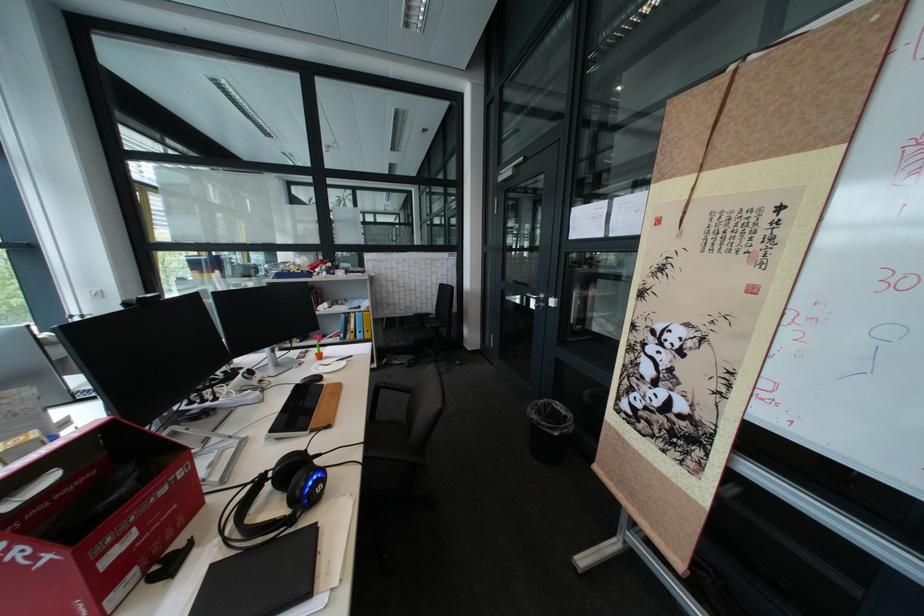
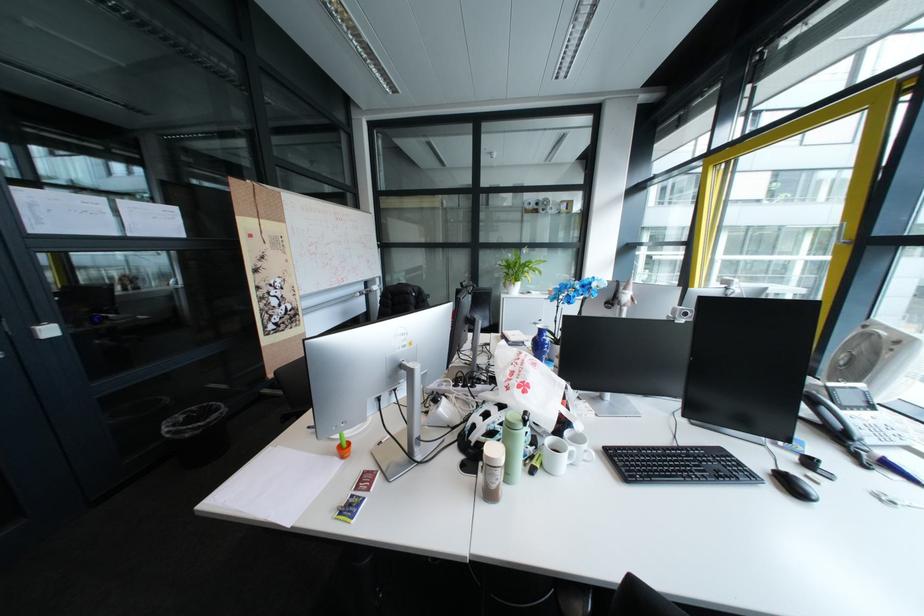
Question: I am providing you with two images of the same scene from different viewpoints. After the viewpoint changes to image2, which objects are now occluded?

Choices:
 (A) black chair sitting surface
 (B) white pear object
 (C) orange pen holder
 (D) brown plastic shaker

Answer: (A)